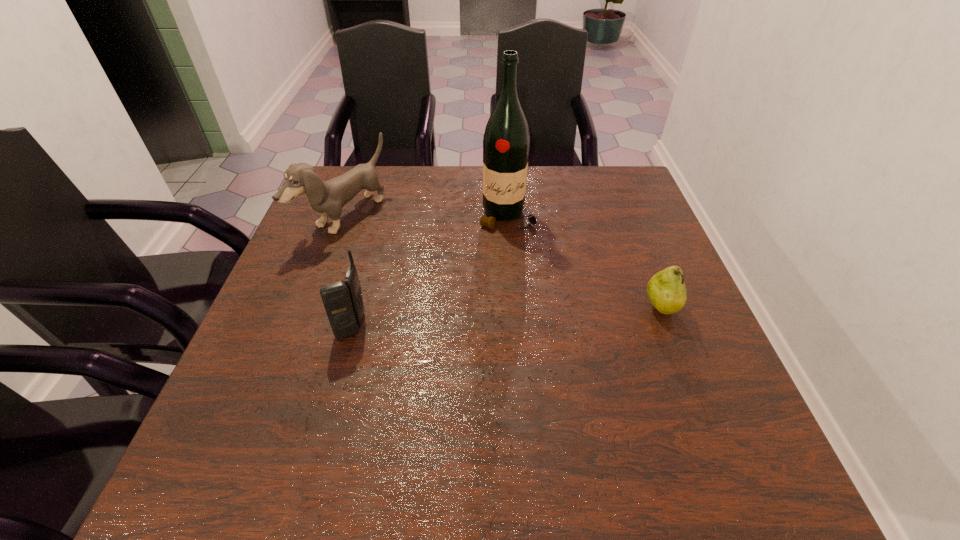
Where is `vacant space on the desktop that is between the cellular telephone and the pear and is positioned on the surface of the tallest object`? The width and height of the screenshot is (960, 540). vacant space on the desktop that is between the cellular telephone and the pear and is positioned on the surface of the tallest object is located at coordinates (519, 316).

Find the location of a particular element. vacant spot on the desktop that is between the cellular telephone and the rightmost object and is positioned at the face of the puppy is located at coordinates (547, 315).